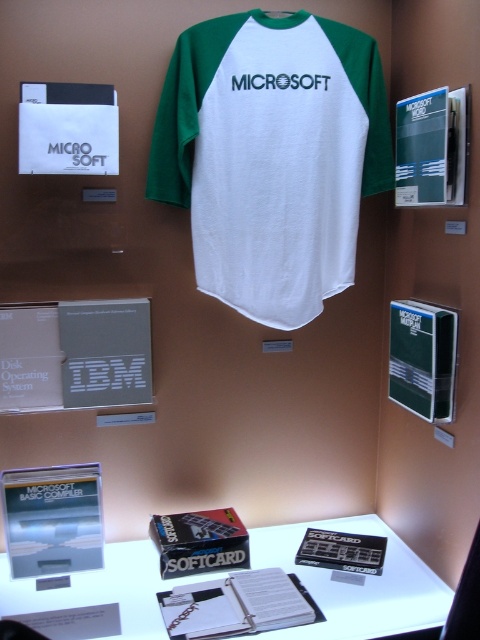
Is point (244, 81) positioned after point (151, 614)?

Yes, it is.

You are a GUI agent. You are given a task and a screenshot of the screen. Output one action in this format:
    pyautogui.click(x=<x>, y=<y>)
    Task: Click on the green/white jersey at center
    
    Given the screenshot: What is the action you would take?
    pyautogui.click(x=272, y=156)

Which is behind, point (230, 113) or point (31, 605)?

The point (230, 113) is behind.

Find the location of a particular element. The height and width of the screenshot is (640, 480). green/white jersey at center is located at coordinates (272, 156).

Can you confirm if white glossy table at lower center is positioned to the right of gray cardboard box at lower left?

Indeed, white glossy table at lower center is positioned on the right side of gray cardboard box at lower left.

Can you confirm if white glossy table at lower center is smaller than gray cardboard box at lower left?

Incorrect, white glossy table at lower center is not smaller in size than gray cardboard box at lower left.

At what (x,y) coordinates should I click in order to perform the action: click on white glossy table at lower center. Please return your answer as a coordinate pair (x, y). Image resolution: width=480 pixels, height=640 pixels. Looking at the image, I should click on (356, 584).

Image resolution: width=480 pixels, height=640 pixels. In order to click on white glossy table at lower center in this screenshot , I will do `click(356, 584)`.

Which is below, white glossy table at lower center or white paper folder at center?

Positioned lower is white paper folder at center.

Is white glossy table at lower center further to the viewer compared to white paper folder at center?

Yes.

Between point (98, 579) and point (207, 604), which one is positioned in front?

Positioned in front is point (207, 604).

At what (x,y) coordinates should I click in order to perform the action: click on white glossy table at lower center. Please return your answer as a coordinate pair (x, y). The image size is (480, 640). Looking at the image, I should click on (356, 584).